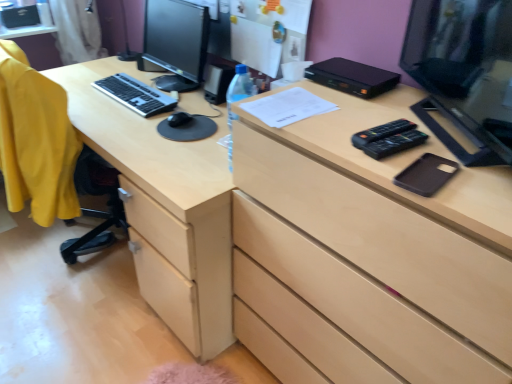
Locate an element on the screen. free point above light wood chest of drawers at center (from a real-world perspective) is located at coordinates (386, 120).